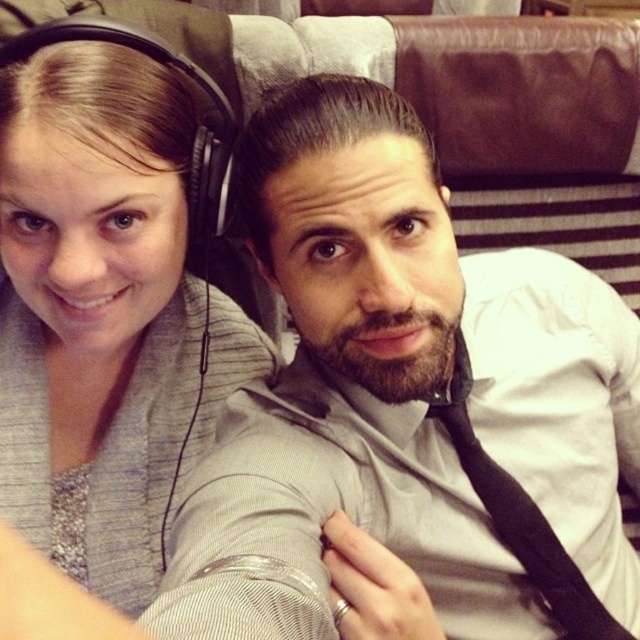
Question: Which object is closer to the camera taking this photo?

Choices:
 (A) matte white shirt at center
 (B) gray fabric at upper left

Answer: (A)

Question: Does matte white shirt at center have a lesser width compared to gray fabric at upper left?

Choices:
 (A) no
 (B) yes

Answer: (A)

Question: From the image, what is the correct spatial relationship of matte white shirt at center in relation to gray fabric at upper left?

Choices:
 (A) left
 (B) right

Answer: (B)

Question: Which of the following is the farthest from the observer?

Choices:
 (A) (144, 184)
 (B) (412, 499)

Answer: (B)

Question: Among these objects, which one is farthest from the camera?

Choices:
 (A) gray fabric at upper left
 (B) matte white shirt at center

Answer: (A)

Question: Is matte white shirt at center smaller than gray fabric at upper left?

Choices:
 (A) no
 (B) yes

Answer: (A)